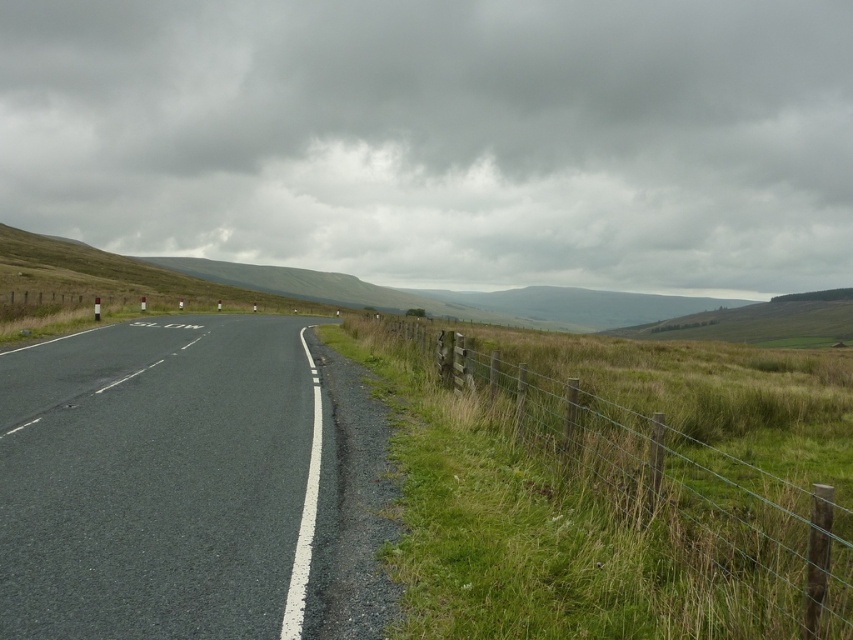
Question: Does asphalt road at center have a lesser width compared to green wire fence at right?

Choices:
 (A) yes
 (B) no

Answer: (B)

Question: Which point appears closest to the camera in this image?

Choices:
 (A) (10, 480)
 (B) (494, 404)

Answer: (A)

Question: Which point is closer to the camera taking this photo?

Choices:
 (A) (184, 321)
 (B) (654, 420)

Answer: (B)

Question: In this image, where is asphalt road at center located relative to green wire fence at right?

Choices:
 (A) right
 (B) left

Answer: (B)

Question: Is asphalt road at center thinner than green wire fence at right?

Choices:
 (A) no
 (B) yes

Answer: (A)

Question: Which point is closer to the camera?

Choices:
 (A) (178, 445)
 (B) (689, 568)

Answer: (B)